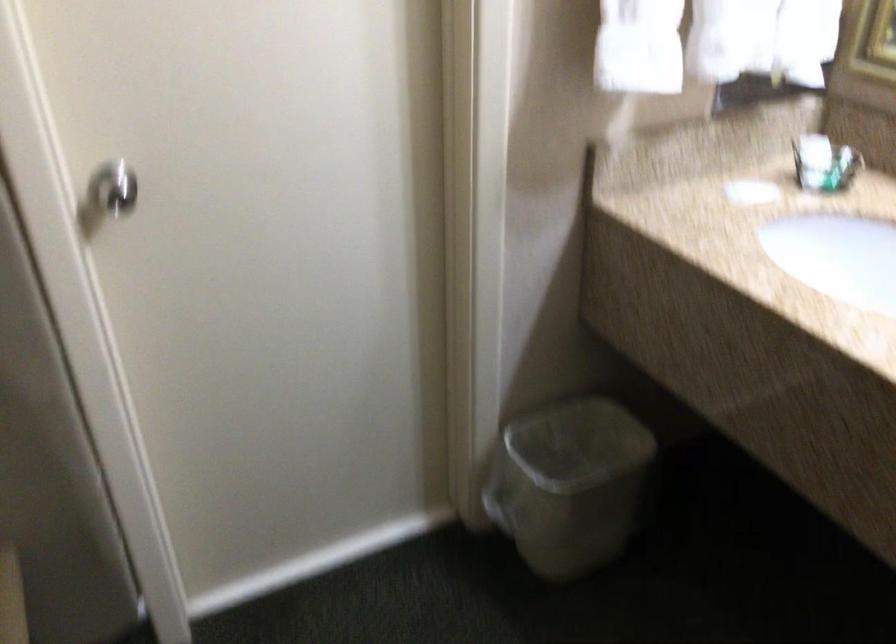
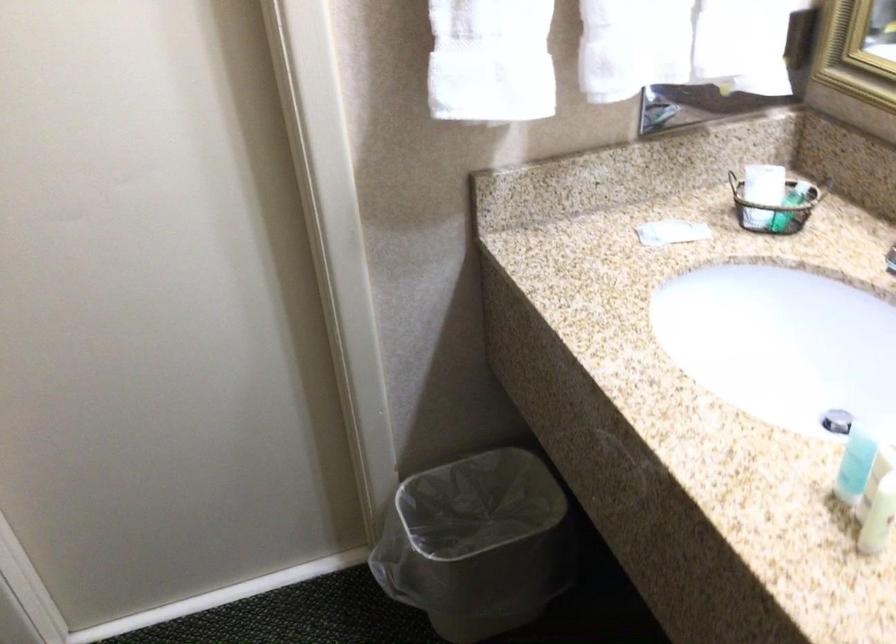
What movement of the cameraman would produce the second image?

The cameraman walked toward right, forward.